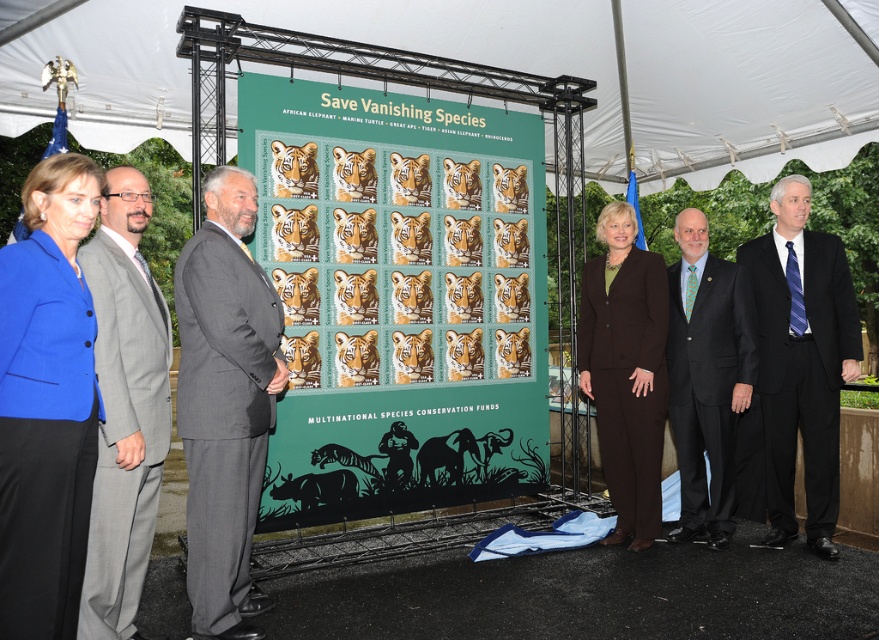
Which is behind, point (354, 369) or point (175, 141)?

Positioned behind is point (175, 141).

This screenshot has height=640, width=879. In order to click on green matte poster at center in this screenshot , I will do `click(398, 298)`.

Does point (776, 420) come closer to viewer compared to point (658, 497)?

Yes, it is.

Is black silk suit at center thinner than brown woolen suit at center?

Incorrect, black silk suit at center's width is not less than brown woolen suit at center's.

Does point (803, 413) come behind point (625, 404)?

No, (803, 413) is in front of (625, 404).

You are a GUI agent. You are given a task and a screenshot of the screen. Output one action in this format:
    pyautogui.click(x=<x>, y=<y>)
    Task: Click on the black silk suit at center
    This screenshot has height=640, width=879.
    Given the screenshot: What is the action you would take?
    pyautogui.click(x=801, y=360)

Which is above, white fabric canopy at upper center or blue fabric jacket at left?

white fabric canopy at upper center is higher up.

Between white fabric canopy at upper center and blue fabric jacket at left, which one appears on the left side from the viewer's perspective?

blue fabric jacket at left

The image size is (879, 640). Find the location of `white fabric canopy at upper center`. white fabric canopy at upper center is located at coordinates (304, 32).